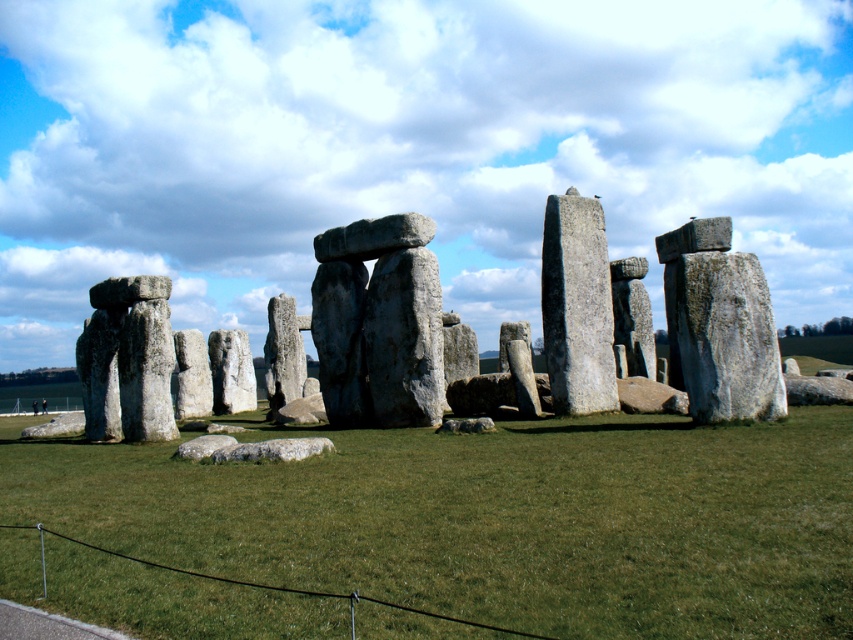
You are standing at the visitor viewpoint at Stonehenge and want to take a photo that includes both the point at coordinates point (383, 497) and point (587, 310). Based on their positions, which point should be closer to the camera in your photo?

Point (383, 497) is in front of point 0.486, 0.89, so in your photo, point (383, 497) will appear closer to the camera.